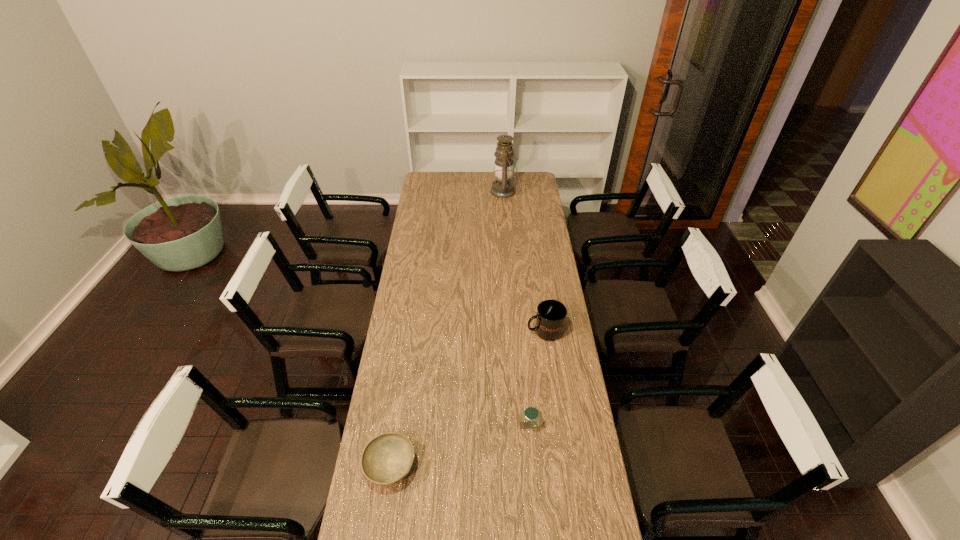
The width and height of the screenshot is (960, 540). I want to click on vacant region between the oil lamp and the third shortest object, so click(x=524, y=261).

Locate an element on the screen. The width and height of the screenshot is (960, 540). unoccupied area between the tallest object and the leftmost object is located at coordinates (447, 329).

This screenshot has height=540, width=960. Identify the location of free space between the second shortest object and the bowl. (460, 446).

The image size is (960, 540). In order to click on object that is the second closest to the tallest object in this screenshot , I will do `click(531, 414)`.

In order to click on object that stands as the second closest to the second shortest object in this screenshot , I will do `click(551, 315)`.